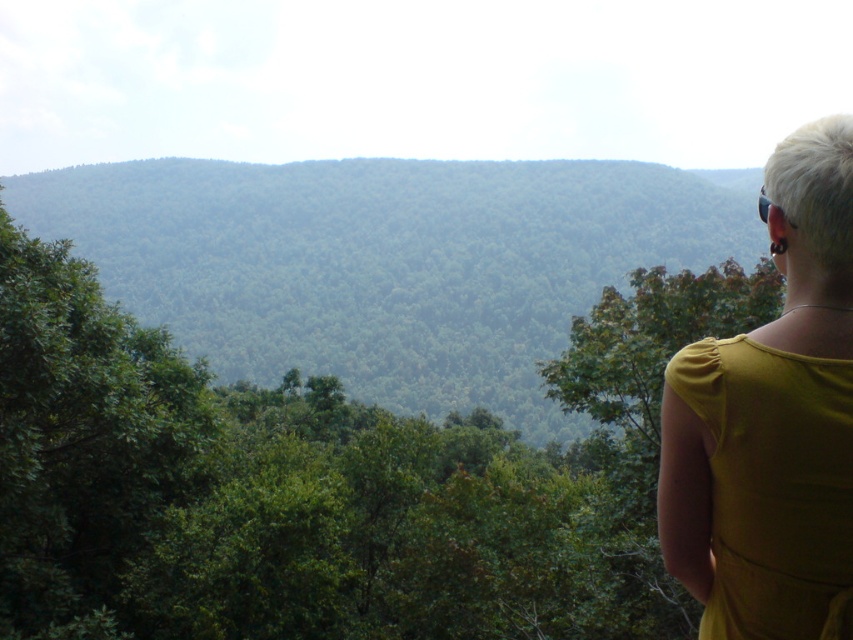
Question: Does green leafy tree at upper right appear under green leafy tree at right?

Choices:
 (A) no
 (B) yes

Answer: (A)

Question: Which object is closer to the camera taking this photo?

Choices:
 (A) mustard yellow dress at right
 (B) green leafy tree at right

Answer: (A)

Question: Which of the following is the farthest from the observer?

Choices:
 (A) (561, 321)
 (B) (846, 561)
 (C) (631, 602)

Answer: (A)

Question: Where is green leafy tree at upper right located in relation to green leafy tree at right in the image?

Choices:
 (A) right
 (B) left

Answer: (B)

Question: Which point appears farthest from the camera in this image?

Choices:
 (A) (799, 445)
 (B) (119, 460)

Answer: (B)

Question: Is green leafy tree at upper right to the right of mustard yellow dress at right from the viewer's perspective?

Choices:
 (A) yes
 (B) no

Answer: (B)